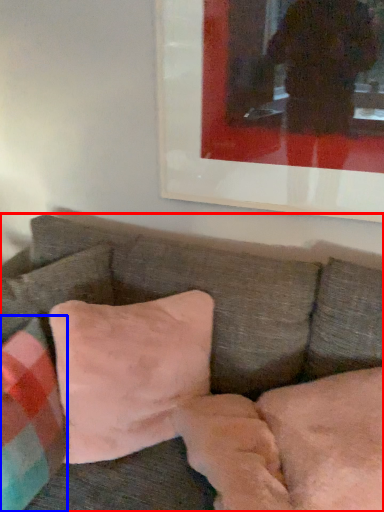
Question: Which of the following is the closest to the observer, studio couch (highlighted by a red box) or pillow (highlighted by a blue box)?

Choices:
 (A) studio couch
 (B) pillow

Answer: (A)